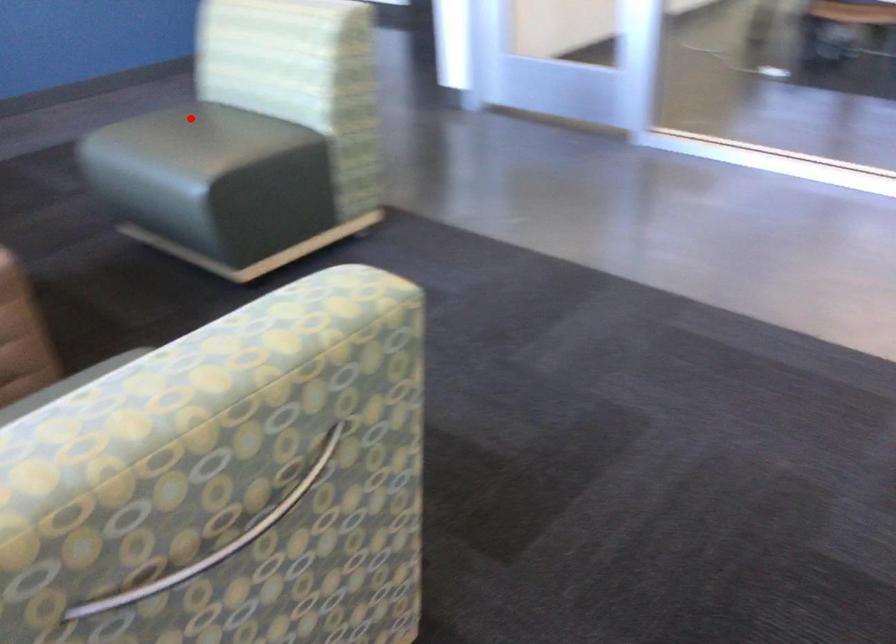
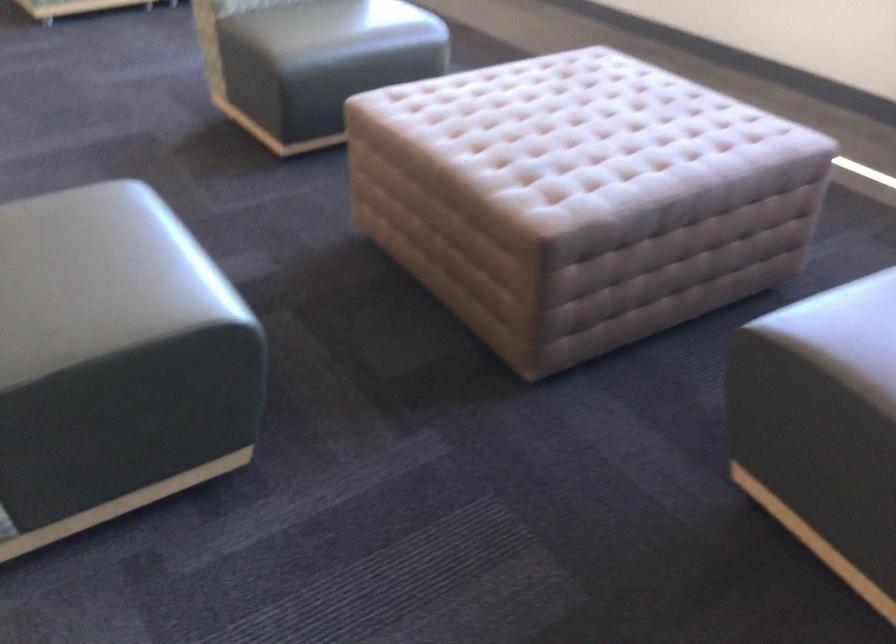
Question: A red point is marked in image1. In image2, is the corresponding 3D point closer to the camera or farther? Reply with the corresponding letter.

Choices:
 (A) The corresponding 3D point is closer.
 (B) The corresponding 3D point is farther.

Answer: (A)